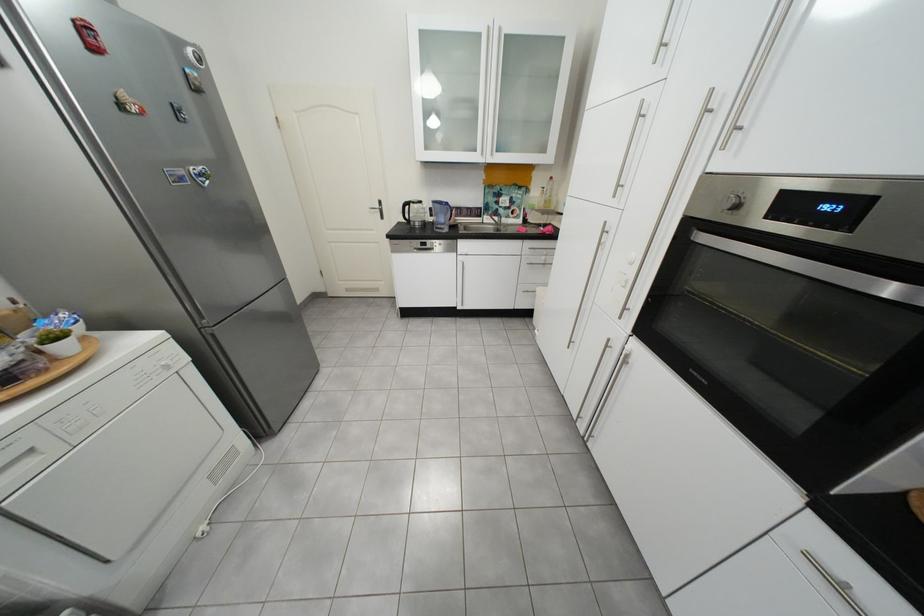
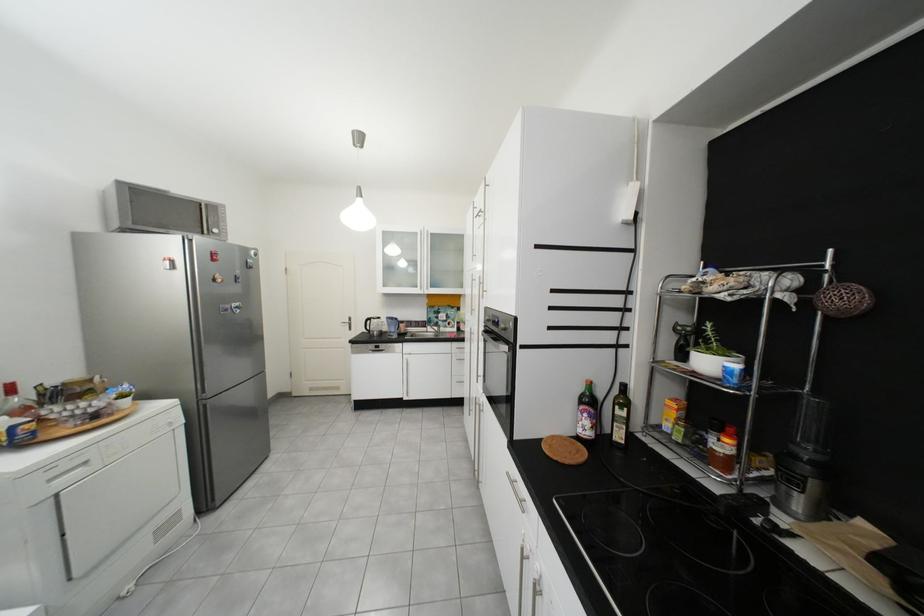
Which direction would the cameraman need to move to produce the second image?

The cameraman walked toward right, backward.